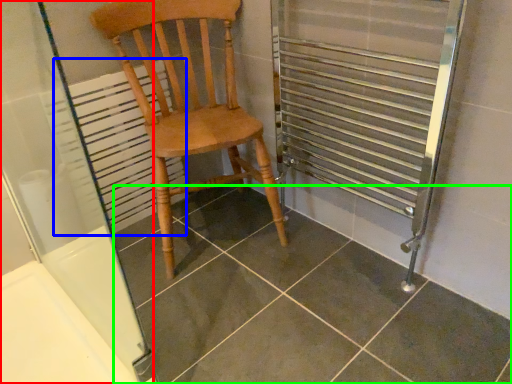
Question: Based on their relative distances, which object is farther from screen door (highlighted by a red box)? Choose from radiator (highlighted by a blue box) and tile (highlighted by a green box).

Choices:
 (A) radiator
 (B) tile

Answer: (B)